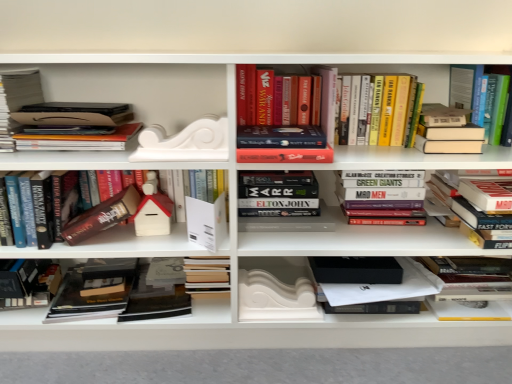
From the picture: Measure the distance between hardcover book at center, the 3th paperback book in the right-to-left sequence, and camera.

They are 3.99 feet apart.

What do you see at coordinates (16, 101) in the screenshot? The height and width of the screenshot is (384, 512). I see `matte cardboard box at upper left, which is the 10th book in right-to-left order` at bounding box center [16, 101].

At what (x,y) coordinates should I click in order to perform the action: click on matte cardboard box at upper left, positioned as the 1th book in left-to-right order. Please return your answer as a coordinate pair (x, y). This screenshot has width=512, height=384. Looking at the image, I should click on (16, 101).

Measure the distance between point (413, 77) and camera.

4.21 feet.

How much space does hardcover books at upper center, placed as the 6th book when sorted from left to right, occupy vertically?

8.75 inches.

The width and height of the screenshot is (512, 384). What do you see at coordinates (479, 95) in the screenshot? I see `hardcover book at upper right, the 1th book viewed from the right` at bounding box center [479, 95].

Describe the element at coordinates (278, 193) in the screenshot. I see `hardcover book at center, which appears as the sixth book when viewed from the right` at that location.

Find the location of a particular element. The width and height of the screenshot is (512, 384). hardcover book at lower left, which appears as the first paperback book when viewed from the left is located at coordinates (93, 291).

Identify the location of hardcover book at center, the 3th paperback book in the right-to-left sequence. (155, 299).

How different are the orientations of white matte book at center, the second paperback book when ordered from right to left, and matte brown book at left, which is counted as the fourth paperback book, starting from the right, in degrees?

4.2 degrees separate the facing orientations of white matte book at center, the second paperback book when ordered from right to left, and matte brown book at left, which is counted as the fourth paperback book, starting from the right.

Is point (194, 234) farther from camera compared to point (106, 204)?

That is True.

Identify the location of the 1st paperback book below the matte brown book at left, which is counted as the fourth paperback book, starting from the right (from the image's perspective). Image resolution: width=512 pixels, height=384 pixels. (206, 222).

From the image's perspective, is white matte book at center, the second paperback book when ordered from right to left, on matte brown book at left, arranged as the second paperback book when viewed from the left?

Incorrect, from the image's perspective, white matte book at center, the second paperback book when ordered from right to left, is lower than matte brown book at left, arranged as the second paperback book when viewed from the left.

Which object is more forward, matte cardboard box at left, marked as the eighth book in a right-to-left arrangement, or hardcover book at center, which appears as the sixth book when viewed from the right?

Positioned in front is matte cardboard box at left, marked as the eighth book in a right-to-left arrangement.

Which book is the 6th one when counting from the back of the matte cardboard box at left, acting as the 3th book starting from the left? Please provide its 2D coordinates.

[(278, 193)]

In the scene shown: From a real-world perspective, which is physically above, matte cardboard box at left, marked as the eighth book in a right-to-left arrangement, or hardcover book at center, marked as the 5th book in a left-to-right arrangement?

In real-world perspective, matte cardboard box at left, marked as the eighth book in a right-to-left arrangement, is above.

In the scene shown: Can you confirm if matte cardboard box at left, marked as the eighth book in a right-to-left arrangement, is shorter than hardcover book at center, which appears as the sixth book when viewed from the right?

Yes, matte cardboard box at left, marked as the eighth book in a right-to-left arrangement, is shorter than hardcover book at center, which appears as the sixth book when viewed from the right.

Which point is more forward, (240,65) or (466,153)?

Point (466,153)

Which object is positioned more to the left, hardcover books at upper center, placed as the 6th book when sorted from left to right, or hardcover book at upper right, acting as the 8th book starting from the left?

From the viewer's perspective, hardcover books at upper center, placed as the 6th book when sorted from left to right, appears more on the left side.

What's the angular difference between hardcover books at upper center, acting as the fifth book starting from the right, and hardcover book at upper right, the third book positioned from the right,'s facing directions?

They differ by 0.000886 degrees in their facing directions.

Could you tell me if hardcover books at upper center, acting as the fifth book starting from the right, is facing hardcover book at upper right, the third book positioned from the right?

No, hardcover books at upper center, acting as the fifth book starting from the right, is not turned towards hardcover book at upper right, the third book positioned from the right.

Is hardcover book at right, the 9th book when ordered from left to right, aimed at white matte book at center, the second paperback book when ordered from right to left?

No, hardcover book at right, the 9th book when ordered from left to right, is not facing towards white matte book at center, the second paperback book when ordered from right to left.

Does point (488, 195) lie behind point (221, 243)?

No, (488, 195) is closer to viewer.

Is hardcover book at right, the second book when ordered from right to left, not within white matte book at center, the 4th paperback book when ordered from left to right?

Yes, hardcover book at right, the second book when ordered from right to left, is outside of white matte book at center, the 4th paperback book when ordered from left to right.

From a real-world perspective, which object stands above the other?

hardcover book at right, the 9th book when ordered from left to right, from a real-world perspective.

From a real-world perspective, is hardcover book at right, the 9th book when ordered from left to right, below hardcover book at lower left, the 5th paperback book in the right-to-left sequence?

No, from a real-world perspective, hardcover book at right, the 9th book when ordered from left to right, is not beneath hardcover book at lower left, the 5th paperback book in the right-to-left sequence.

Is point (479, 179) closer or farther from the camera than point (78, 269)?

Point (479, 179) is positioned closer to the camera compared to point (78, 269).

Can you confirm if hardcover book at right, the 9th book when ordered from left to right, is shorter than hardcover book at lower left, which appears as the first paperback book when viewed from the left?

No, hardcover book at right, the 9th book when ordered from left to right, is not shorter than hardcover book at lower left, which appears as the first paperback book when viewed from the left.

Is hardcover book at right, the 9th book when ordered from left to right, turned away from hardcover book at lower left, which appears as the first paperback book when viewed from the left?

No.

Is hardcover book at right, the second book when ordered from right to left, inside or outside of hardcover book at center, which appears as the sixth book when viewed from the right?

hardcover book at right, the second book when ordered from right to left, is spatially situated outside hardcover book at center, which appears as the sixth book when viewed from the right.

Does hardcover book at right, the second book when ordered from right to left, have a lesser height compared to hardcover book at center, marked as the 5th book in a left-to-right arrangement?

Yes.

Are hardcover book at right, the second book when ordered from right to left, and hardcover book at center, marked as the 5th book in a left-to-right arrangement, beside each other?

hardcover book at right, the second book when ordered from right to left, is not next to hardcover book at center, marked as the 5th book in a left-to-right arrangement, and they're not touching.

Locate an element on the screen. The height and width of the screenshot is (384, 512). the 1st book located above the hardcover book at center, which appears as the sixth book when viewed from the right (from a real-world perspective) is located at coordinates (479, 205).

Can you confirm if matte brown book at left, which is counted as the fourth paperback book, starting from the right, is thinner than matte cardboard box at left, marked as the eighth book in a right-to-left arrangement?

A: Yes, matte brown book at left, which is counted as the fourth paperback book, starting from the right, is thinner than matte cardboard box at left, marked as the eighth book in a right-to-left arrangement.

Choose the correct answer: Is matte brown book at left, arranged as the second paperback book when viewed from the left, inside matte cardboard box at left, acting as the 3th book starting from the left, or outside it?

matte brown book at left, arranged as the second paperback book when viewed from the left, is not enclosed by matte cardboard box at left, acting as the 3th book starting from the left.

Between matte brown book at left, arranged as the second paperback book when viewed from the left, and matte cardboard box at left, acting as the 3th book starting from the left, which one has smaller size?

matte brown book at left, arranged as the second paperback book when viewed from the left.

Identify the location of paperback book above the matte brown book at left, which is counted as the fourth paperback book, starting from the right (from a real-world perspective). (206, 222).

The width and height of the screenshot is (512, 384). What are the coordinates of `the 4th book above the hardcover book at center, marked as the 5th book in a left-to-right arrangement (from the image's perspective)` in the screenshot? It's located at point(61,116).

Looking at the image, which one is located further to hardcover book at upper right, placed as the tenth book when sorted from left to right, hardcover book at center, the 3th paperback book in the right-to-left sequence, or white matte book at center, the 4th paperback book when ordered from left to right?

hardcover book at center, the 3th paperback book in the right-to-left sequence, lies further to hardcover book at upper right, placed as the tenth book when sorted from left to right, than the other object.

Estimate the real-world distances between objects in this image. Which object is closer to matte cardboard box at upper left, positioned as the 1th book in left-to-right order, white matte decorative piece at center, marked as the 1th paperback book in a right-to-left arrangement, or hardcover books at upper center, acting as the fifth book starting from the right?

hardcover books at upper center, acting as the fifth book starting from the right.

Estimate the real-world distances between objects in this image. Which object is further from hardcover book at center, the 3th paperback book in the right-to-left sequence, hardcover book at upper right, acting as the 8th book starting from the left, or hardcover books at upper center, acting as the fifth book starting from the right?

hardcover book at upper right, acting as the 8th book starting from the left, is further to hardcover book at center, the 3th paperback book in the right-to-left sequence.

Which object lies nearer to the anchor point hardcover book at center, which appears as the 3th paperback book when viewed from the left, hardcover book at upper right, placed as the tenth book when sorted from left to right, or white matte house at center, which is the fourth book from left to right?

Among the two, white matte house at center, which is the fourth book from left to right, is located nearer to hardcover book at center, which appears as the 3th paperback book when viewed from the left.

Which object lies nearer to the anchor point matte cardboard box at upper left, which is the 10th book in right-to-left order, matte cardboard box at left, marked as the eighth book in a right-to-left arrangement, or white matte book at center, the 4th paperback book when ordered from left to right?

Among the two, matte cardboard box at left, marked as the eighth book in a right-to-left arrangement, is located nearer to matte cardboard box at upper left, which is the 10th book in right-to-left order.

From the picture: From the image, which object appears to be farther from hardcover books at upper center, acting as the fifth book starting from the right, matte cardboard box at left, marked as the eighth book in a right-to-left arrangement, or white matte book at center, the second paperback book when ordered from right to left?

matte cardboard box at left, marked as the eighth book in a right-to-left arrangement, lies further to hardcover books at upper center, acting as the fifth book starting from the right, than the other object.

Estimate the real-world distances between objects in this image. Which object is further from hardcover book at lower left, which appears as the first paperback book when viewed from the left, hardcover book at upper right, placed as the tenth book when sorted from left to right, or matte cardboard box at left, acting as the 3th book starting from the left?

The object further to hardcover book at lower left, which appears as the first paperback book when viewed from the left, is hardcover book at upper right, placed as the tenth book when sorted from left to right.

When comparing their distances from hardcover book at center, marked as the 5th book in a left-to-right arrangement, does white matte house at center, the seventh book when ordered from right to left, or hardcover books at center, the seventh book when ordered from left to right, seem closer?

Based on the image, hardcover books at center, the seventh book when ordered from left to right, appears to be nearer to hardcover book at center, marked as the 5th book in a left-to-right arrangement.

What are the coordinates of `book located between matte brown book at left, arranged as the second paperback book when viewed from the left, and hardcover book at center, marked as the 5th book in a left-to-right arrangement, in the left-right direction` in the screenshot? It's located at (157, 209).

Locate an element on the screen. The image size is (512, 384). book between matte cardboard box at left, marked as the eighth book in a right-to-left arrangement, and hardcover book at center, marked as the 5th book in a left-to-right arrangement, in the horizontal direction is located at coordinates (157, 209).

You are a GUI agent. You are given a task and a screenshot of the screen. Output one action in this format:
    pyautogui.click(x=<x>, y=<y>)
    Task: Click on the paperback book between hardcover book at center, the 3th paperback book in the right-to-left sequence, and white matte decorative piece at center, marked as the 1th paperback book in a right-to-left arrangement
    
    Given the screenshot: What is the action you would take?
    pyautogui.click(x=206, y=222)

The image size is (512, 384). I want to click on paperback book between hardcover book at lower left, which is counted as the 9th book, starting from the right, and matte brown book at left, arranged as the second paperback book when viewed from the left, in the horizontal direction, so click(x=93, y=291).